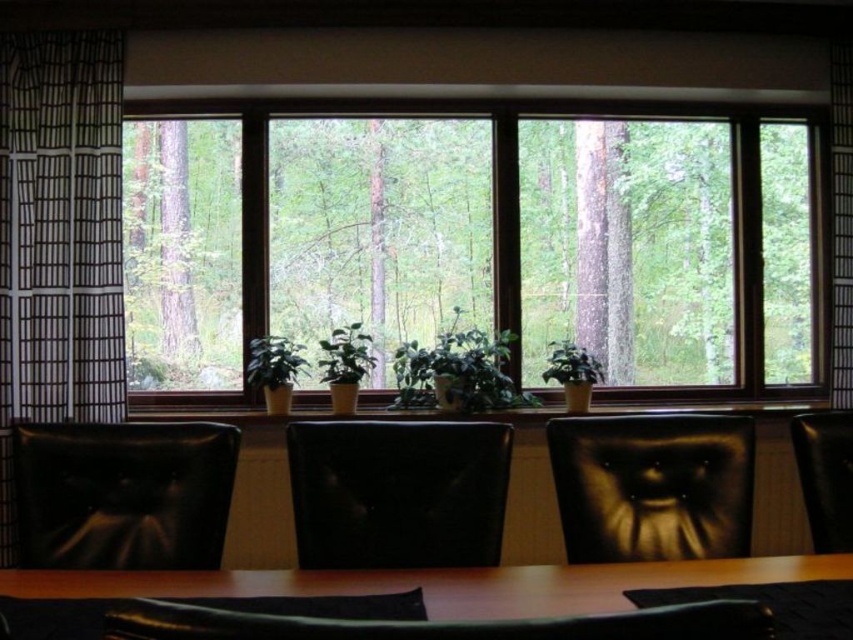
Question: Which point is closer to the camera taking this photo?

Choices:
 (A) (456, 385)
 (B) (393, 198)

Answer: (A)

Question: Based on their relative distances, which object is farther from the black leather chair at center?

Choices:
 (A) green matte plant at center
 (B) dark brown leather armchair at center
 (C) transparent glass window at center

Answer: (C)

Question: Which object is the farthest from the dark brown leather armchair at center?

Choices:
 (A) black leather armchair at center
 (B) black leather armchair at left
 (C) transparent glass window at center

Answer: (C)

Question: Is black leather armchair at left positioned behind brown wooden table at center?

Choices:
 (A) yes
 (B) no

Answer: (A)

Question: Does dark brown leather armchair at center lie in front of green matte plant at center?

Choices:
 (A) no
 (B) yes

Answer: (B)

Question: In this image, where is black paper at left located relative to black leather chair at center?

Choices:
 (A) right
 (B) left

Answer: (B)